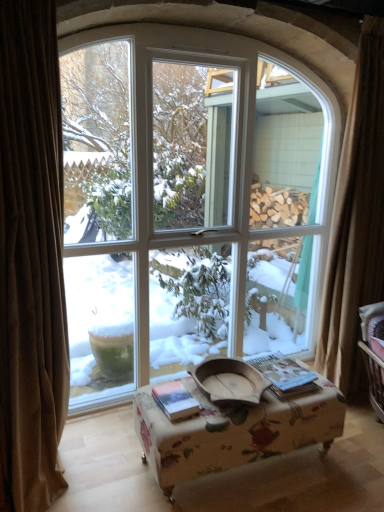
Question: From a real-world perspective, is hardcover book at center, the 2th book in the right-to-left sequence, above or below floral fabric ottoman at center?

Choices:
 (A) above
 (B) below

Answer: (A)

Question: Relative to floral fabric ottoman at center, is hardcover book at center, marked as the 1th book in a left-to-right arrangement, in front or behind?

Choices:
 (A) front
 (B) behind

Answer: (B)

Question: Which object is the closest to the brown velvet curtain at left, positioned as the first curtain in left-to-right order?

Choices:
 (A) white glass window at center
 (B) hardcover book at center, the 2th book positioned from the left
 (C) brown curtain at right, marked as the first curtain in a back-to-front arrangement
 (D) floral fabric ottoman at center
 (E) hardcover book at center, marked as the 1th book in a left-to-right arrangement

Answer: (E)

Question: Based on their relative distances, which object is nearer to the brown velvet curtain at left, the second curtain positioned from the right?

Choices:
 (A) brown curtain at right, which is the second curtain from front to back
 (B) floral fabric ottoman at center
 (C) hardcover book at center, the 2th book in the right-to-left sequence
 (D) hardcover book at center, acting as the first book starting from the right
 (E) white glass window at center

Answer: (C)